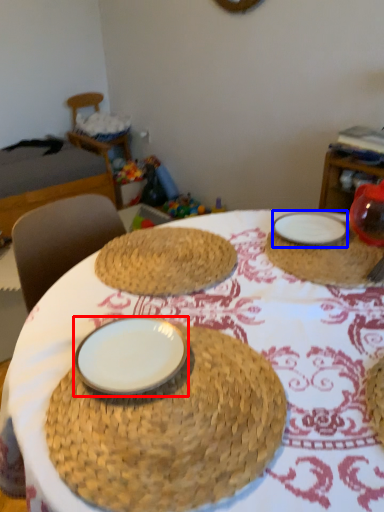
Question: Which object is closer to the camera taking this photo, plate (highlighted by a red box) or plate (highlighted by a blue box)?

Choices:
 (A) plate
 (B) plate

Answer: (A)